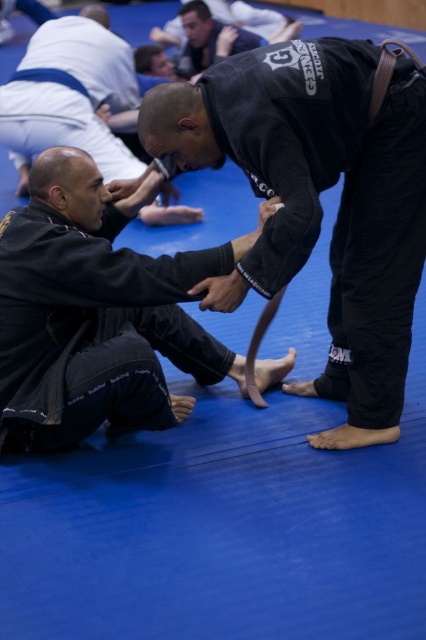
Question: Can you confirm if black matte gi at lower left is positioned to the right of black matte gi at center?

Choices:
 (A) no
 (B) yes

Answer: (B)

Question: Estimate the real-world distances between objects in this image. Which object is farther from the black matte gi at lower left?

Choices:
 (A) black matte uniform at upper center
 (B) black matte gi at center

Answer: (B)

Question: From the image, what is the correct spatial relationship of black matte uniform at upper center in relation to black matte gi at center?

Choices:
 (A) right
 (B) left

Answer: (A)

Question: Does black matte uniform at upper center have a smaller size compared to black matte gi at center?

Choices:
 (A) no
 (B) yes

Answer: (B)

Question: Among these points, which one is nearest to the camera?

Choices:
 (A) (365, 344)
 (B) (69, 84)
 (C) (173, 362)

Answer: (A)

Question: Which is farther from the black matte uniform at upper center?

Choices:
 (A) black matte gi at center
 (B) black matte gi at lower left

Answer: (A)